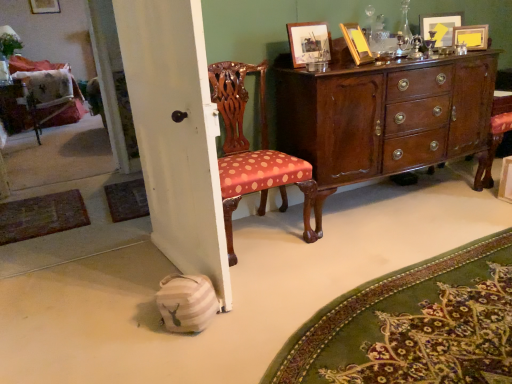
Find the location of a particular element. unoccupied area in front of woven brown mat at lower left, positioned as the 2th mat in right-to-left order is located at coordinates (86, 231).